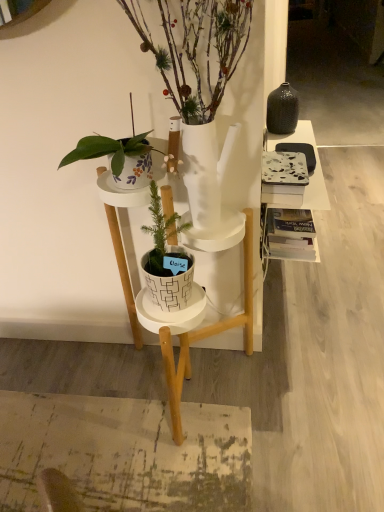
Question: From the image's perspective, is marble-patterned book at right located beneath white glossy pot at center, arranged as the 1th houseplant when viewed from the top?

Choices:
 (A) yes
 (B) no

Answer: (A)

Question: Can you confirm if marble-patterned book at right is smaller than white glossy pot at center, arranged as the 1th houseplant when viewed from the top?

Choices:
 (A) no
 (B) yes

Answer: (B)

Question: Is the surface of marble-patterned book at right in direct contact with white glossy pot at center, arranged as the 1th houseplant when viewed from the top?

Choices:
 (A) yes
 (B) no

Answer: (B)

Question: Considering the relative sizes of marble-patterned book at right and white glossy pot at center, which ranks as the 2th houseplant in bottom-to-top order, in the image provided, is marble-patterned book at right wider than white glossy pot at center, which ranks as the 2th houseplant in bottom-to-top order,?

Choices:
 (A) yes
 (B) no

Answer: (B)

Question: Is marble-patterned book at right at the left side of white glossy pot at center, which ranks as the 2th houseplant in bottom-to-top order?

Choices:
 (A) no
 (B) yes

Answer: (A)

Question: Is point (200, 24) positioned closer to the camera than point (276, 188)?

Choices:
 (A) closer
 (B) farther

Answer: (A)

Question: Choose the correct answer: Is white glossy pot at center, arranged as the 1th houseplant when viewed from the top, inside marble-patterned book at right or outside it?

Choices:
 (A) inside
 (B) outside

Answer: (B)

Question: Is white glossy pot at center, arranged as the 1th houseplant when viewed from the top, to the left or to the right of marble-patterned book at right in the image?

Choices:
 (A) right
 (B) left

Answer: (B)

Question: Relative to marble-patterned book at right, is white glossy pot at center, arranged as the 1th houseplant when viewed from the top, in front or behind?

Choices:
 (A) front
 (B) behind

Answer: (A)

Question: In terms of height, does white textured pot at center, positioned as the first houseplant in bottom-to-top order, look taller or shorter compared to marble-patterned book at right?

Choices:
 (A) tall
 (B) short

Answer: (A)

Question: Looking at their shapes, would you say white textured pot at center, positioned as the first houseplant in bottom-to-top order, is wider or thinner than marble-patterned book at right?

Choices:
 (A) thin
 (B) wide

Answer: (B)

Question: In the image, is white textured pot at center, marked as the 2th houseplant in a top-to-bottom arrangement, on the left side or the right side of marble-patterned book at right?

Choices:
 (A) left
 (B) right

Answer: (A)

Question: Relative to marble-patterned book at right, is white textured pot at center, positioned as the first houseplant in bottom-to-top order, in front or behind?

Choices:
 (A) front
 (B) behind

Answer: (A)

Question: Choose the correct answer: Is marble-patterned book at right inside white matte plant stand at center or outside it?

Choices:
 (A) outside
 (B) inside

Answer: (A)

Question: Considering the positions of marble-patterned book at right and white matte plant stand at center in the image, is marble-patterned book at right bigger or smaller than white matte plant stand at center?

Choices:
 (A) big
 (B) small

Answer: (B)